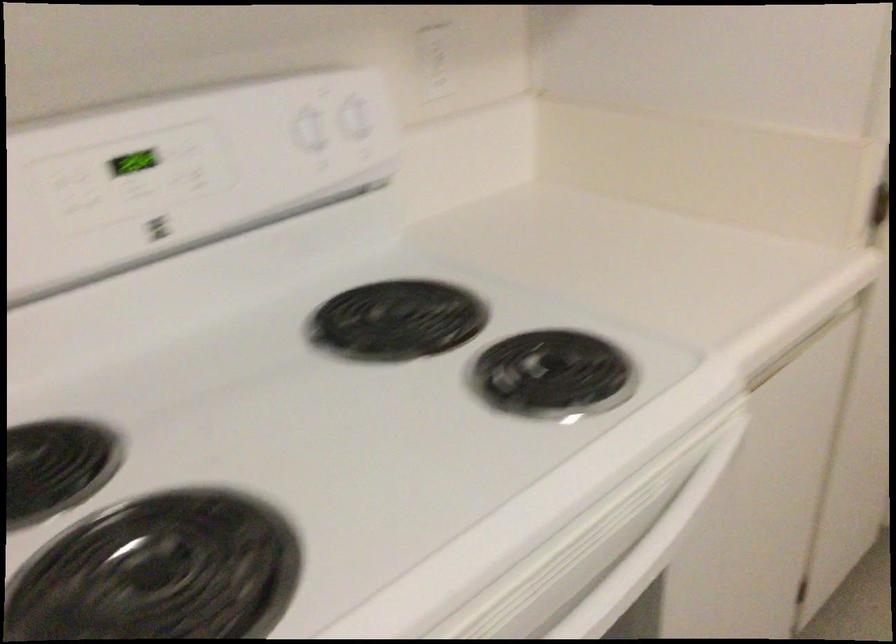
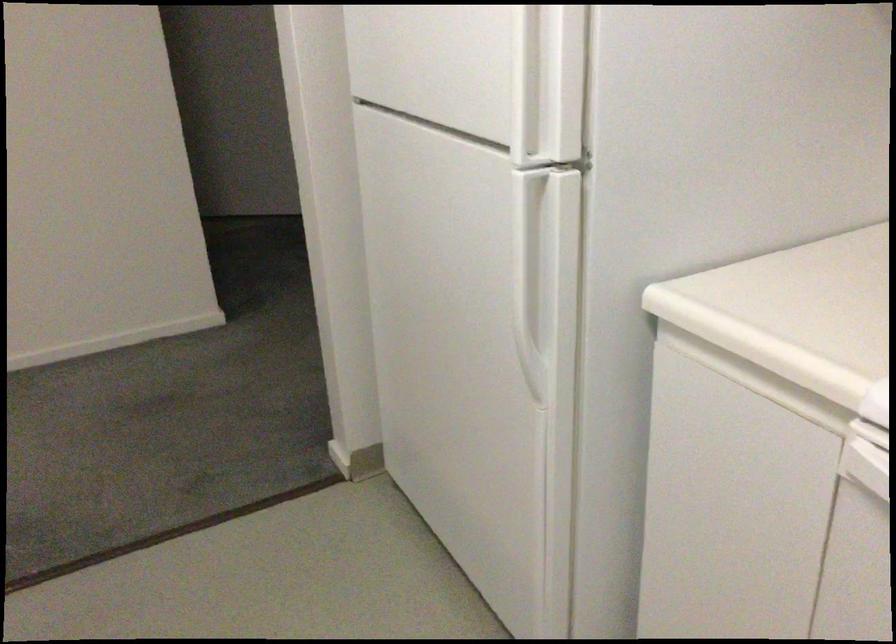
The first image is from the beginning of the video and the second image is from the end. How did the camera likely rotate when shooting the video?

The camera rotated toward left-down.